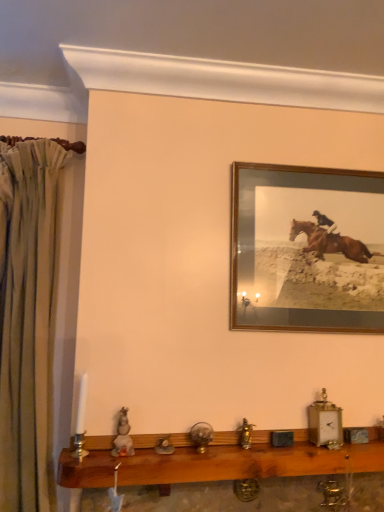
Question: Can you confirm if wooden shelf at lower center is bigger than wooden frame at upper right?

Choices:
 (A) no
 (B) yes

Answer: (B)

Question: From a real-world perspective, is wooden shelf at lower center physically above wooden frame at upper right?

Choices:
 (A) yes
 (B) no

Answer: (B)

Question: From a real-world perspective, does wooden shelf at lower center sit lower than wooden frame at upper right?

Choices:
 (A) no
 (B) yes

Answer: (B)

Question: Is wooden shelf at lower center with wooden frame at upper right?

Choices:
 (A) yes
 (B) no

Answer: (B)

Question: Is wooden shelf at lower center to the left of wooden frame at upper right from the viewer's perspective?

Choices:
 (A) yes
 (B) no

Answer: (A)

Question: Does wooden shelf at lower center have a smaller size compared to wooden frame at upper right?

Choices:
 (A) yes
 (B) no

Answer: (B)

Question: From a real-world perspective, is wooden frame at upper right on top of beige fabric curtain at left?

Choices:
 (A) no
 (B) yes

Answer: (B)

Question: Is wooden frame at upper right positioned in front of beige fabric curtain at left?

Choices:
 (A) no
 (B) yes

Answer: (A)

Question: From a real-world perspective, is wooden frame at upper right under beige fabric curtain at left?

Choices:
 (A) no
 (B) yes

Answer: (A)

Question: Is wooden frame at upper right facing away from beige fabric curtain at left?

Choices:
 (A) yes
 (B) no

Answer: (B)

Question: Is wooden frame at upper right to the left of beige fabric curtain at left from the viewer's perspective?

Choices:
 (A) no
 (B) yes

Answer: (A)

Question: Is wooden frame at upper right smaller than beige fabric curtain at left?

Choices:
 (A) yes
 (B) no

Answer: (A)

Question: Is beige fabric curtain at left at the left side of wooden frame at upper right?

Choices:
 (A) no
 (B) yes

Answer: (B)